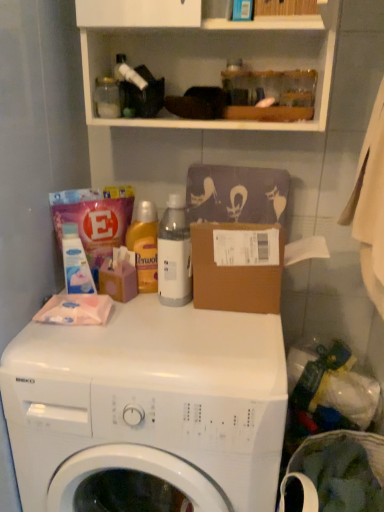
Where is `vacant space in front of white matte detergent at left`? Image resolution: width=384 pixels, height=512 pixels. vacant space in front of white matte detergent at left is located at coordinates (71, 336).